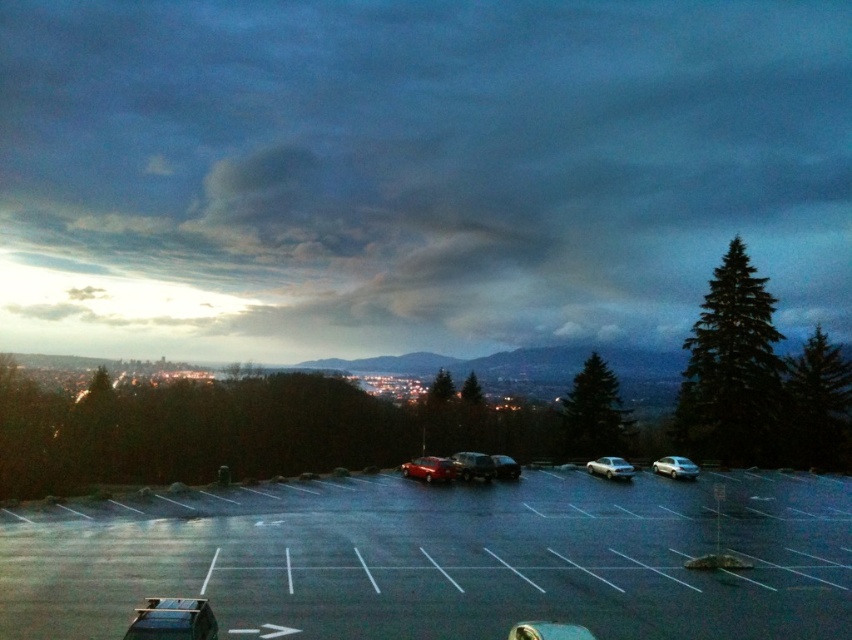
Question: Can you confirm if shiny metallic car at center is positioned below shiny black sedan at center?

Choices:
 (A) no
 (B) yes

Answer: (A)

Question: Does metallic silver car at lower left have a lesser width compared to shiny black sedan at center?

Choices:
 (A) yes
 (B) no

Answer: (A)

Question: Is satin silver sedan at center to the left of satin silver sedan at right from the viewer's perspective?

Choices:
 (A) yes
 (B) no

Answer: (A)

Question: Among these points, which one is farthest from the camera?

Choices:
 (A) (617, 476)
 (B) (442, 476)
 (C) (697, 472)
 (D) (462, 476)

Answer: (C)

Question: Which of these objects is positioned closest to the shiny metallic car at center?

Choices:
 (A) shiny silver sedan at center
 (B) metallic silver car at lower left

Answer: (A)

Question: Which point appears closest to the camera in this image?

Choices:
 (A) (498, 461)
 (B) (609, 456)

Answer: (A)